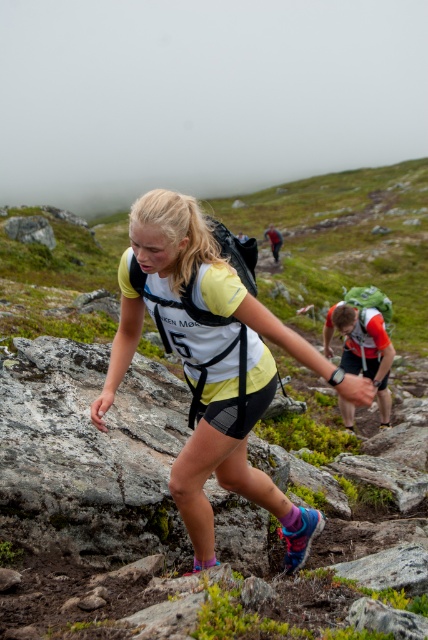
Question: Is yellow fabric shirt at center in front of orange mesh backpack at center?

Choices:
 (A) no
 (B) yes

Answer: (B)

Question: Which object is farther from the camera taking this photo?

Choices:
 (A) orange mesh backpack at center
 (B) yellow fabric shirt at center

Answer: (A)

Question: From the image, what is the correct spatial relationship of yellow fabric shirt at center in relation to orange mesh backpack at center?

Choices:
 (A) above
 (B) below

Answer: (A)

Question: Considering the relative positions of yellow fabric shirt at center and orange mesh backpack at center in the image provided, where is yellow fabric shirt at center located with respect to orange mesh backpack at center?

Choices:
 (A) above
 (B) below

Answer: (A)

Question: Which of the following is the closest to the observer?

Choices:
 (A) orange mesh backpack at center
 (B) yellow fabric shirt at center

Answer: (B)

Question: Which of the following is the closest to the observer?

Choices:
 (A) orange mesh backpack at center
 (B) yellow fabric shirt at center

Answer: (B)